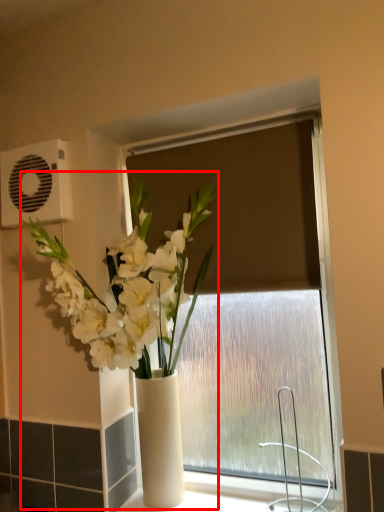
Question: Where is houseplant (annotated by the red box) located in relation to air conditioning in the image?

Choices:
 (A) left
 (B) right

Answer: (B)